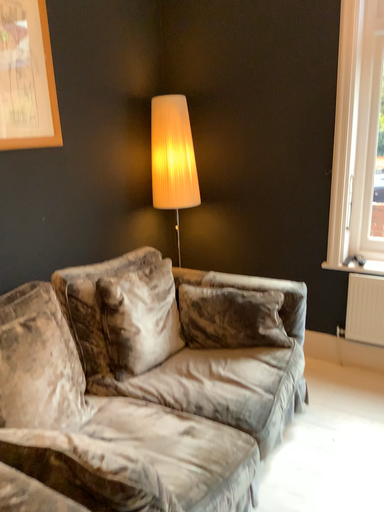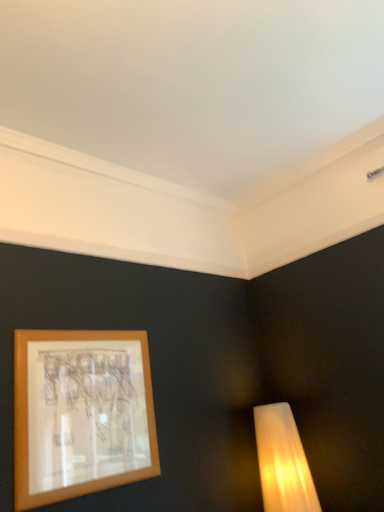
Question: Which way did the camera rotate in the video?

Choices:
 (A) rotated downward
 (B) rotated upward

Answer: (B)